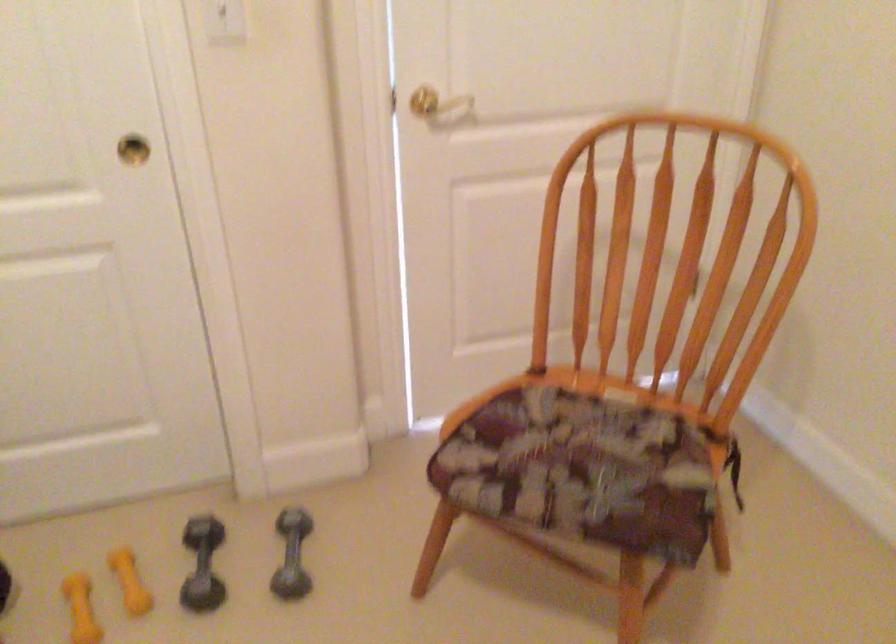
Image resolution: width=896 pixels, height=644 pixels. Describe the element at coordinates (424, 102) in the screenshot. I see `the gold door handle` at that location.